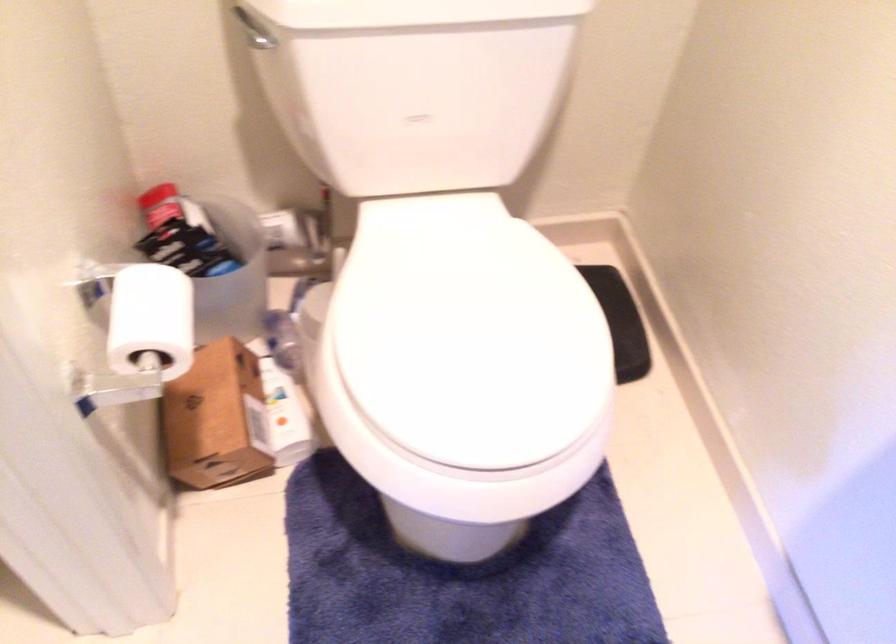
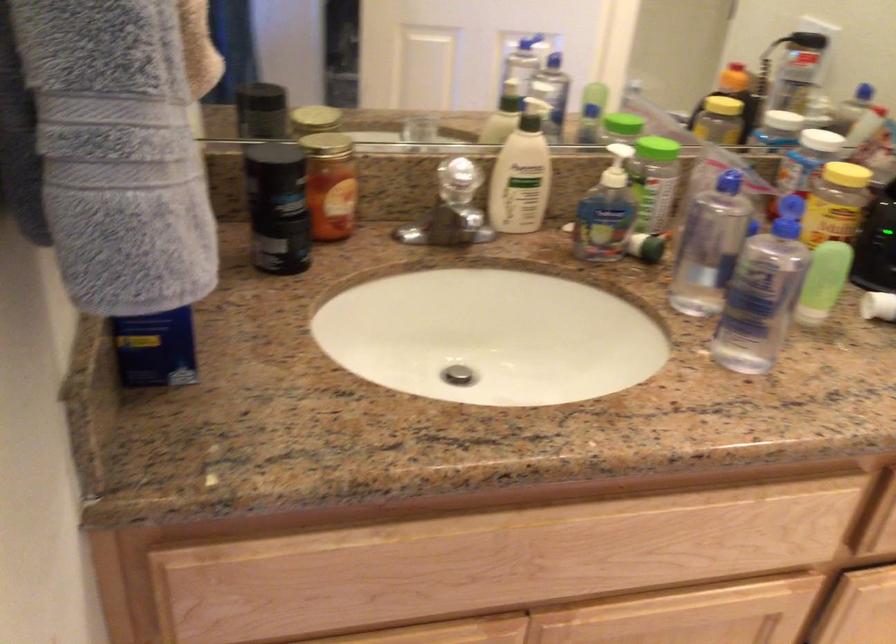
Question: In a continuous first-person perspective shot, in which direction is the camera moving?

Choices:
 (A) Left
 (B) Right
 (C) Forward
 (D) Backward

Answer: (A)